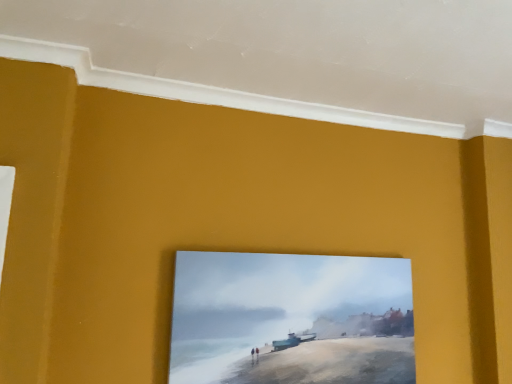
I want to click on printed canvas painting at center, so click(291, 319).

Describe the element at coordinates (291, 319) in the screenshot. I see `printed canvas painting at center` at that location.

You are a GUI agent. You are given a task and a screenshot of the screen. Output one action in this format:
    pyautogui.click(x=<x>, y=<y>)
    Task: Click on the printed canvas painting at center
    
    Given the screenshot: What is the action you would take?
    coord(291,319)